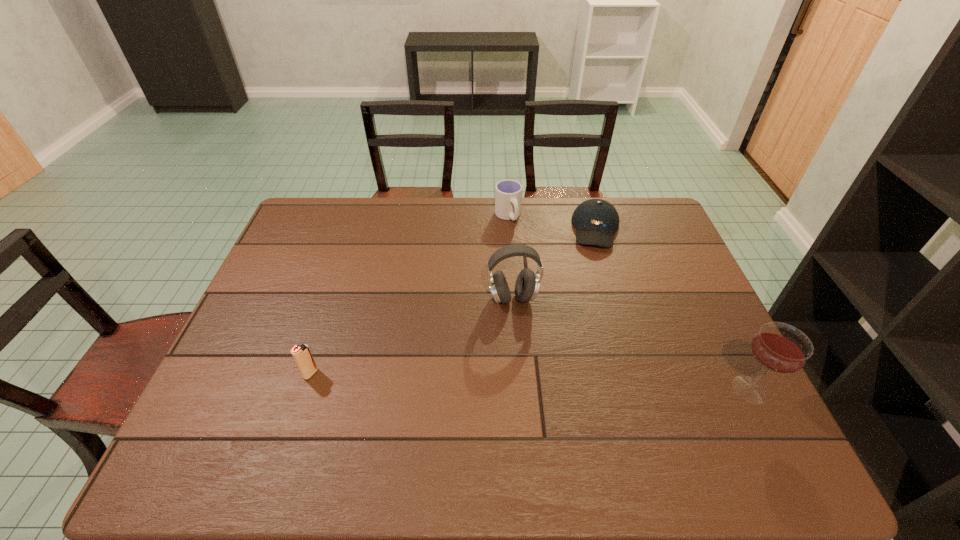
Where is `the leftmost object`? the leftmost object is located at coordinates (301, 354).

Identify the location of wineglass. This screenshot has width=960, height=540. (778, 347).

I want to click on headset, so click(527, 285).

This screenshot has height=540, width=960. I want to click on cup, so click(x=508, y=193).

Image resolution: width=960 pixels, height=540 pixels. I want to click on the second object from right to left, so click(x=596, y=220).

The width and height of the screenshot is (960, 540). I want to click on the shortest object, so click(596, 220).

Find the location of a particular element. The width and height of the screenshot is (960, 540). blank space located 0.320m on the right of the igniter is located at coordinates (444, 374).

At what (x,y) coordinates should I click in order to perform the action: click on free space located on the back of the rightmost object. Please return your answer as a coordinate pair (x, y). Looking at the image, I should click on (691, 273).

The height and width of the screenshot is (540, 960). In order to click on free spot located 0.080m on the ear cups of the headset in this screenshot , I will do `click(516, 333)`.

Where is `vacant area situated on the ear cups of the headset`? vacant area situated on the ear cups of the headset is located at coordinates (521, 388).